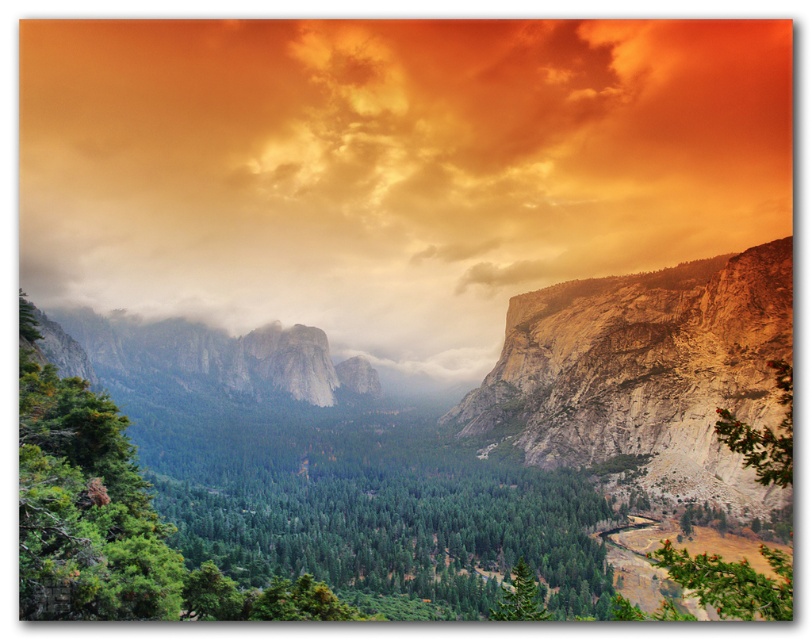
In the scene shown: Is the position of rugged granite mountains at center more distant than that of green matte tree at lower center?

No, it is in front of green matte tree at lower center.

I want to click on rugged granite mountains at center, so click(x=382, y=465).

Locate an element on the screen. rugged granite mountains at center is located at coordinates (382, 465).

Is green matte tree at lower left wider than green matte tree at lower center?

Yes, green matte tree at lower left is wider than green matte tree at lower center.

Does green matte tree at lower left appear on the right side of green matte tree at lower center?

No, green matte tree at lower left is not to the right of green matte tree at lower center.

Describe the element at coordinates (84, 504) in the screenshot. I see `green matte tree at lower left` at that location.

Locate an element on the screen. green matte tree at lower left is located at coordinates (84, 504).

This screenshot has width=812, height=640. Describe the element at coordinates (646, 372) in the screenshot. I see `rugged stone cliff at center` at that location.

Is the position of rugged stone cliff at center less distant than that of green matte tree at lower left?

No.

Is point (703, 461) more distant than point (117, 520)?

Yes, point (703, 461) is farther from viewer.

At what (x,y) coordinates should I click in order to perform the action: click on rugged stone cliff at center. Please return your answer as a coordinate pair (x, y). The image size is (812, 640). Looking at the image, I should click on (646, 372).